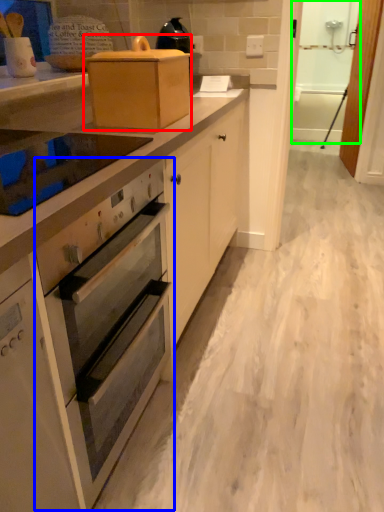
Question: Which object is positioned farthest from appliance (highlighted by a red box)? Select from oven (highlighted by a blue box) and screen door (highlighted by a green box).

Choices:
 (A) oven
 (B) screen door

Answer: (B)